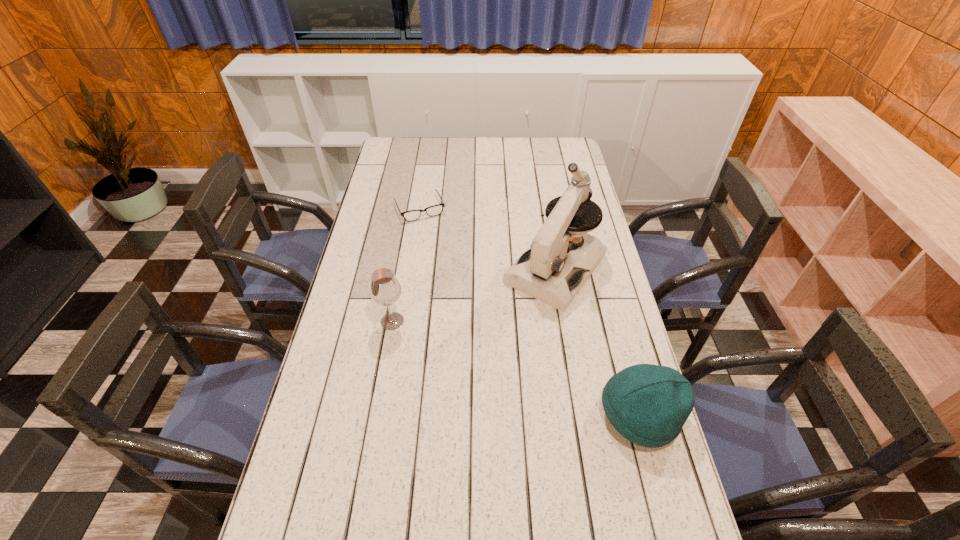
Find the location of a particular element. This screenshot has height=540, width=960. vacant point at the left edge is located at coordinates (409, 166).

The image size is (960, 540). In the image, there is a desktop. Find the location of `vacant area at the right edge`. vacant area at the right edge is located at coordinates (583, 318).

This screenshot has height=540, width=960. Identify the location of vacant point at the far left corner. coord(402,158).

The width and height of the screenshot is (960, 540). In the image, there is a desktop. In order to click on vacant space at the far right corner in this screenshot , I will do `click(571, 141)`.

Image resolution: width=960 pixels, height=540 pixels. What are the coordinates of `vacant point located between the third shortest object and the microscope` in the screenshot? It's located at (474, 295).

Find the location of `free spot between the beanie and the tallest object`. free spot between the beanie and the tallest object is located at coordinates (598, 342).

This screenshot has width=960, height=540. I want to click on unoccupied area between the shortest object and the third shortest object, so click(406, 265).

Locate an element on the screen. This screenshot has width=960, height=540. unoccupied area between the wineglass and the microscope is located at coordinates (474, 295).

Where is `free space between the farthest object and the microscope`? This screenshot has width=960, height=540. free space between the farthest object and the microscope is located at coordinates (488, 239).

The width and height of the screenshot is (960, 540). Identify the location of vacant space that's between the microscope and the second tallest object. (474, 295).